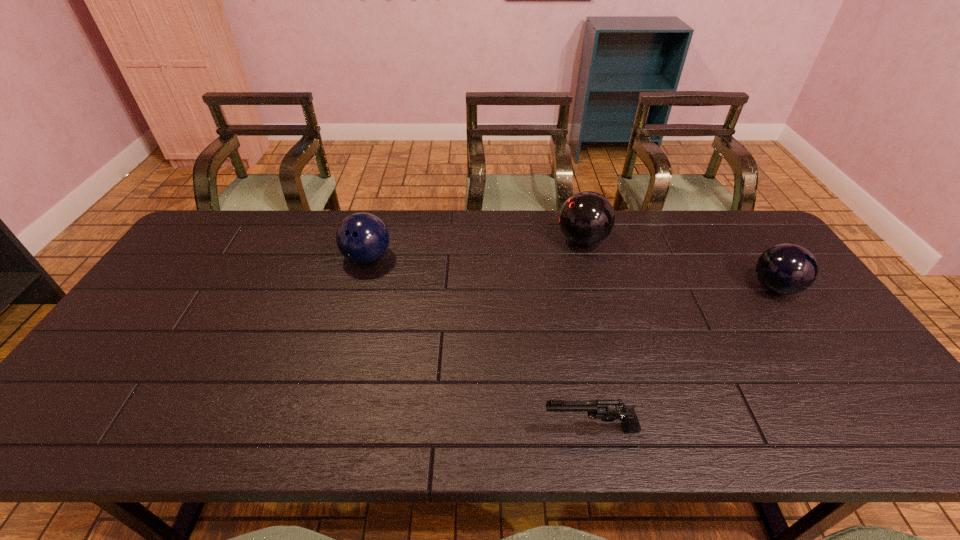
The height and width of the screenshot is (540, 960). Identify the location of vacant area located on the side of the rightmost object with the finger holes. (654, 288).

Identify the location of free space located 0.130m on the side of the rightmost object with the finger holes. (706, 288).

The height and width of the screenshot is (540, 960). What are the coordinates of `free space located at the end of the barrel of the shortest object` in the screenshot? It's located at (478, 429).

Where is `vacant space located 0.170m at the end of the barrel of the shortest object`? This screenshot has height=540, width=960. vacant space located 0.170m at the end of the barrel of the shortest object is located at coordinates (465, 429).

Locate an element on the screen. This screenshot has height=540, width=960. free location located 0.260m at the end of the barrel of the shortest object is located at coordinates (423, 429).

At what (x,y) coordinates should I click in order to perform the action: click on object that is at the near edge. Please return your answer as a coordinate pair (x, y). This screenshot has height=540, width=960. Looking at the image, I should click on (607, 410).

Find the location of `object located at the right edge`. object located at the right edge is located at coordinates (786, 269).

This screenshot has height=540, width=960. In the image, there is a desktop. Find the location of `vacant space at the far edge`. vacant space at the far edge is located at coordinates (513, 224).

In the image, there is a desktop. Where is `vacant space at the near edge`? This screenshot has height=540, width=960. vacant space at the near edge is located at coordinates (163, 415).

Identify the location of vacant region at the left edge of the desktop. (119, 403).